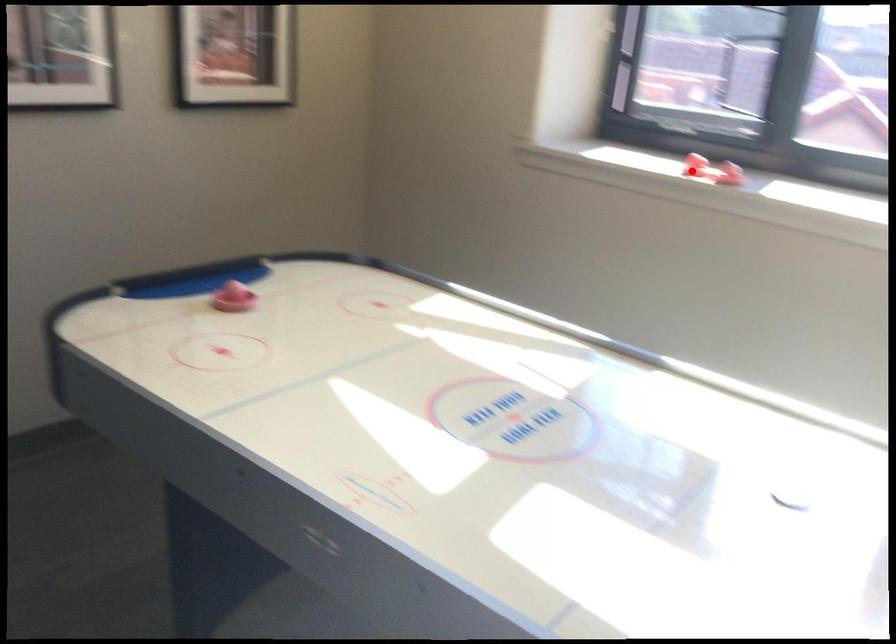
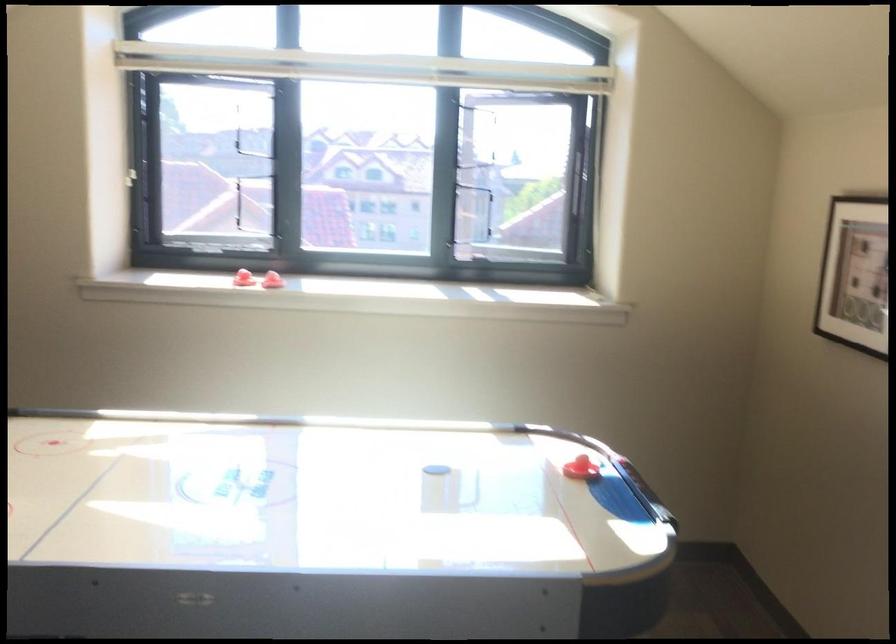
Where in the second image is the point corresponding to the highlighted location from the first image?

(244, 279)